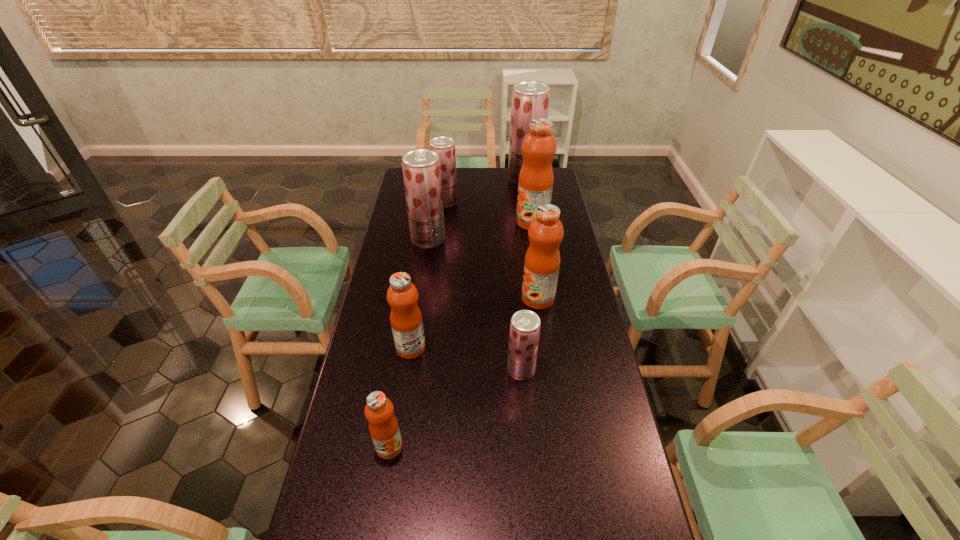
Find the location of a particular element. free space between the nearest orange fruit juice and the nearest strawberry fruit juice is located at coordinates (455, 408).

Locate an element on the screen. unoccupied position between the third biggest orange fruit juice and the third smallest strawberry fruit juice is located at coordinates (420, 294).

Locate an element on the screen. This screenshot has width=960, height=540. unoccupied area between the farthest strawberry fruit juice and the smallest strawberry fruit juice is located at coordinates (523, 274).

This screenshot has width=960, height=540. I want to click on vacant space that's between the third farthest orange fruit juice and the nearest object, so click(400, 397).

The image size is (960, 540). What are the coordinates of `unoccupied area between the second farthest fruit juice and the biggest strawberry fruit juice` in the screenshot? It's located at (485, 190).

Identify the location of vacant area that lies between the biggest orange fruit juice and the third farthest strawberry fruit juice. The width and height of the screenshot is (960, 540). (480, 231).

Locate an element on the screen. The image size is (960, 540). vacant area that lies between the farthest object and the nearest object is located at coordinates (457, 313).

Identify the location of object that is the sixth closest one to the biggest orange fruit juice. (525, 325).

Identify the location of object that is the seventh closest to the third farthest orange fruit juice. (530, 99).

The height and width of the screenshot is (540, 960). Find the location of `the closest fruit juice to the fifth farthest object`. the closest fruit juice to the fifth farthest object is located at coordinates (525, 325).